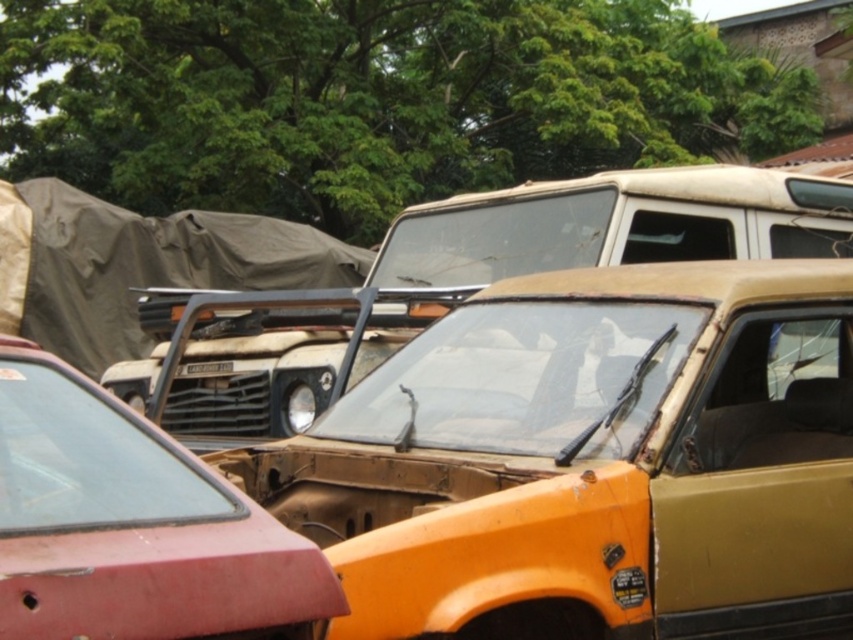
Question: Which point is closer to the camera?

Choices:
 (A) (165, 632)
 (B) (764, 253)

Answer: (A)

Question: Which point appears farthest from the camera in this image?

Choices:
 (A) (x=334, y=577)
 (B) (x=596, y=209)

Answer: (B)

Question: Which of the following is the farthest from the observer?

Choices:
 (A) rusty metal pickup truck at center
 (B) matte red car at lower left

Answer: (A)

Question: Is rusty metal pickup truck at center bigger than matte red car at lower left?

Choices:
 (A) yes
 (B) no

Answer: (A)

Question: Does rusty metal pickup truck at center have a lesser width compared to matte red car at lower left?

Choices:
 (A) yes
 (B) no

Answer: (B)

Question: Considering the relative positions of rusty metal pickup truck at center and matte red car at lower left in the image provided, where is rusty metal pickup truck at center located with respect to matte red car at lower left?

Choices:
 (A) above
 (B) below

Answer: (A)